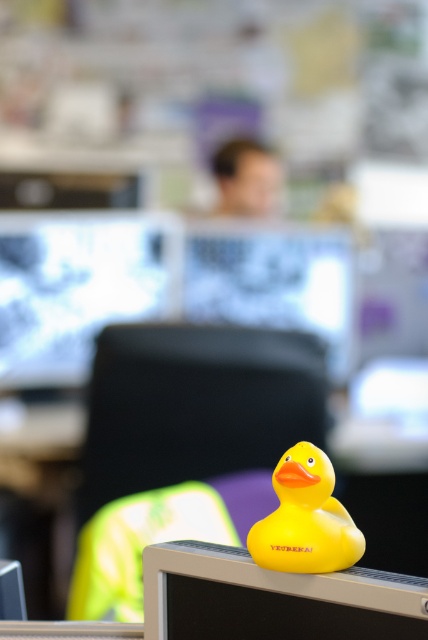
Which of these two, matte black monitor at center or yellow rubber duck at center, stands taller?

matte black monitor at center

Can you confirm if matte black monitor at center is positioned above yellow rubber duck at center?

Indeed, matte black monitor at center is positioned over yellow rubber duck at center.

Between point (222, 227) and point (306, 512), which one is positioned in front?

Point (306, 512) is more forward.

At what (x,y) coordinates should I click in order to perform the action: click on matte black monitor at center. Please return your answer as a coordinate pair (x, y). Looking at the image, I should click on (273, 280).

Which is behind, point (380, 609) or point (270, 292)?

The point (270, 292) is more distant.

Locate an element on the screen. yellow rubber duck at lower center is located at coordinates (273, 598).

The width and height of the screenshot is (428, 640). In order to click on yellow rubber duck at lower center in this screenshot , I will do `click(273, 598)`.

Between point (172, 620) and point (312, 451), which one is positioned behind?

The point (172, 620) is more distant.

Does yellow rubber duck at lower center have a smaller size compared to yellow rubber duck at center?

No, yellow rubber duck at lower center is not smaller than yellow rubber duck at center.

Does point (287, 636) come in front of point (261, 541)?

No, (287, 636) is behind (261, 541).

Find the location of `yellow rubber duck at lower center`. yellow rubber duck at lower center is located at coordinates (273, 598).